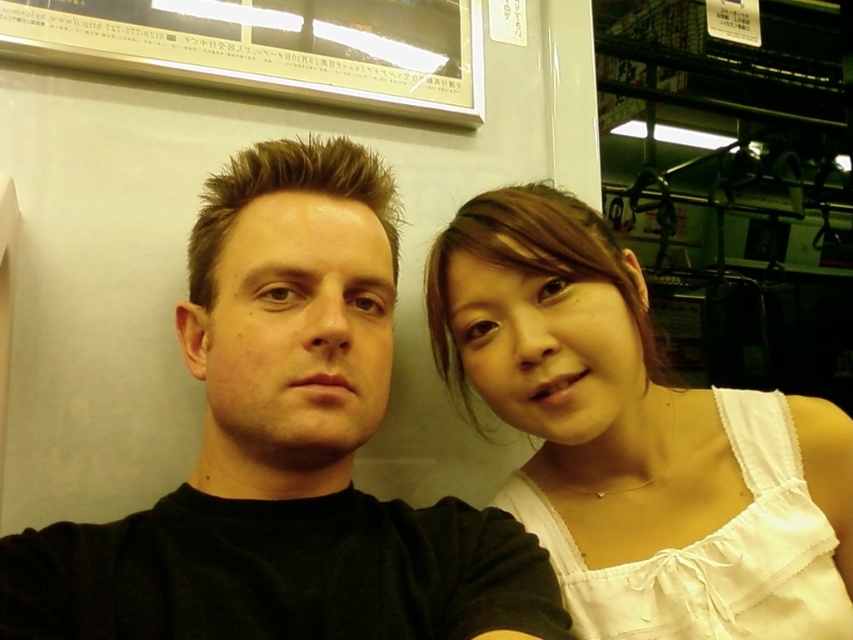
Does black matte shirt at center appear over white cotton tank top at right?

Yes.

Which is more to the right, black matte shirt at center or white cotton tank top at right?

white cotton tank top at right

Locate an element on the screen. The height and width of the screenshot is (640, 853). black matte shirt at center is located at coordinates (286, 449).